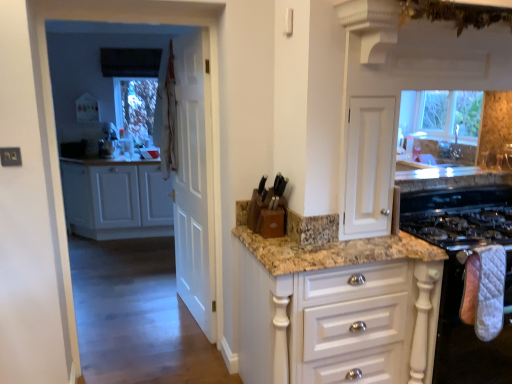
Find the location of `free space above wooden knife block at center, the 1th appliance in the left-to-right sequence (from a real-world perspective)`. free space above wooden knife block at center, the 1th appliance in the left-to-right sequence (from a real-world perspective) is located at coordinates (271, 183).